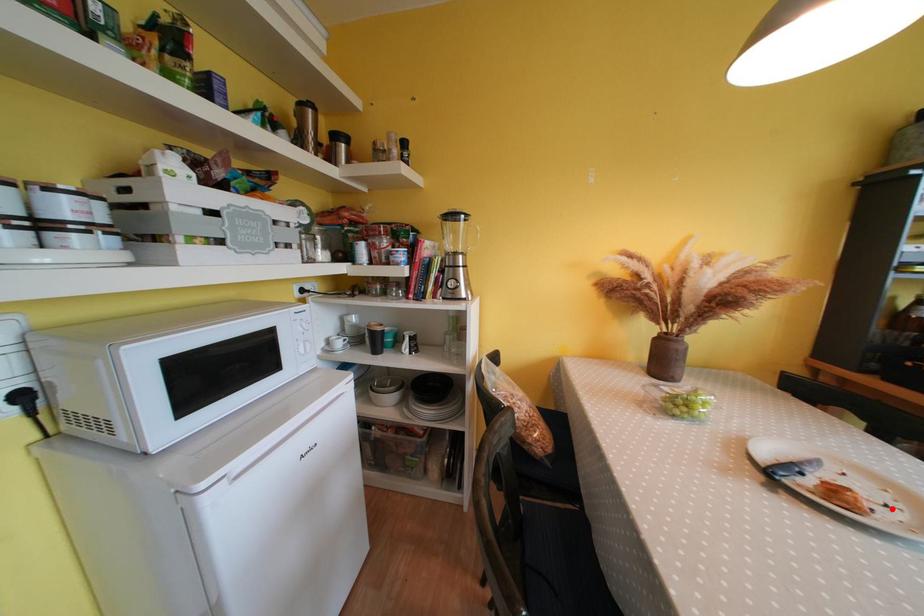
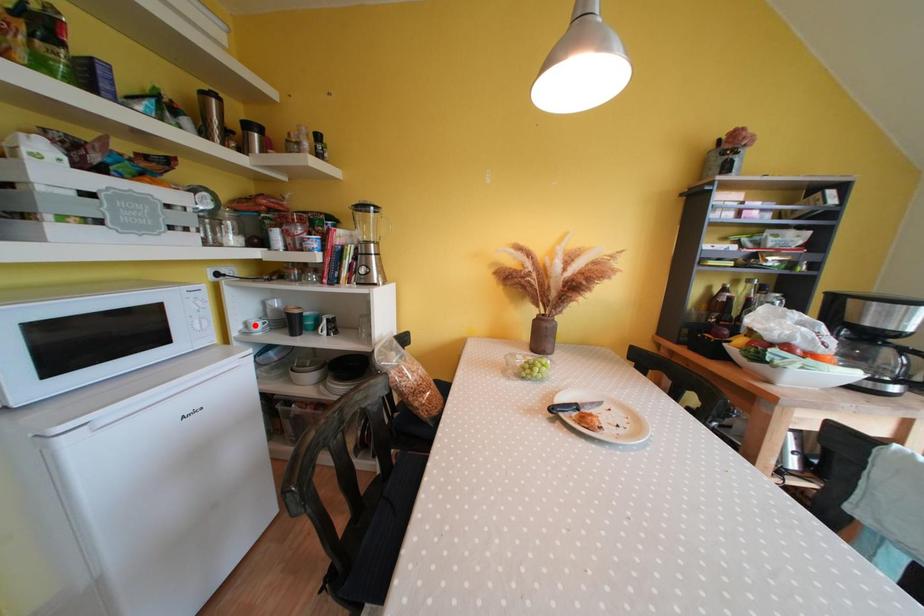
I am providing you with two images of the same scene from different viewpoints. A red point is marked on the first image and another point is marked on the second image. Is the marked point in image1 the same physical position as the marked point in image2?

No